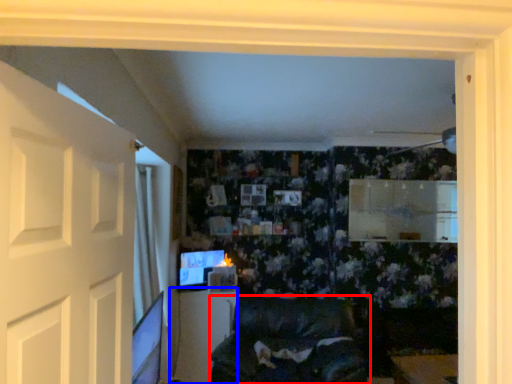
Question: Which of the following is the closest to the observer, furniture (highlighted by a red box) or table (highlighted by a blue box)?

Choices:
 (A) furniture
 (B) table

Answer: (A)